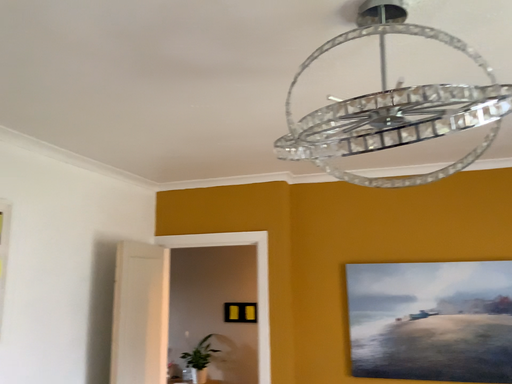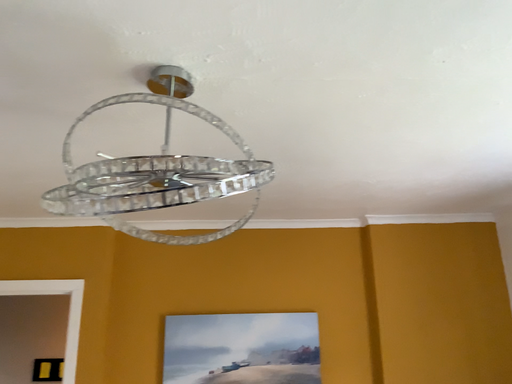
Question: Which way did the camera rotate in the video?

Choices:
 (A) rotated left
 (B) rotated right

Answer: (B)